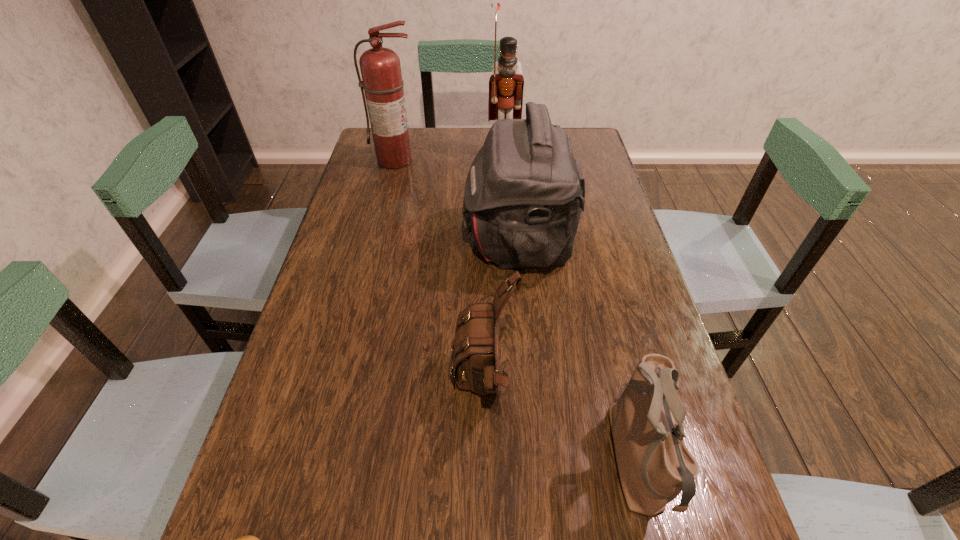
Locate an element on the screen. This screenshot has height=540, width=960. shoulder bag that is the second closest to the fourth nearest object is located at coordinates (654, 464).

Select which shoulder bag is the third closest to the pear. Please provide its 2D coordinates. Your answer should be formatted as a tuple, i.e. [(x, y)], where the tuple contains the x and y coordinates of a point satisfying the conditions above.

[(524, 192)]